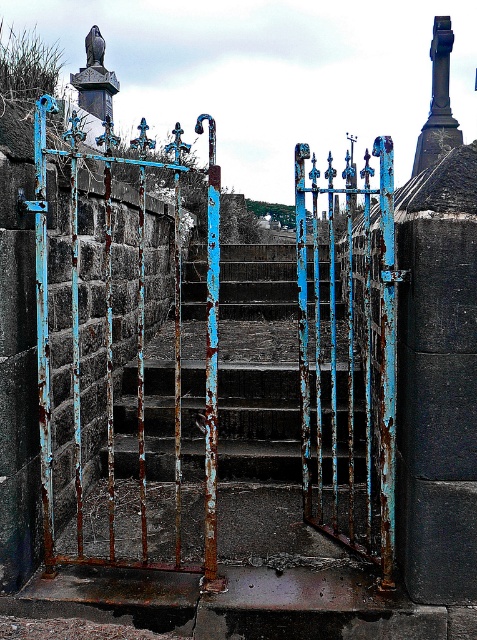
You are a delivery person with a large box that is 1.5 meters wide. You need to pass through the entrance shown in the image. Can your box fit through the rusty metal gate at center without touching the rusty metal stairs at center?

The rusty metal gate at center is narrower than the rusty metal stairs at center. Since your box is 1.5 meters wide and the gate is narrower, the box may not fit through without touching the stairs or the gate itself. It is advisable to find an alternative route or a smaller entrance.

You are standing in front of the weathered metal gate and want to take a photo of both point (382, 406) and point (362, 410). Which point should you focus on first to ensure both are in focus?

Point (382, 406) is closer to the camera than point (362, 410), so you should focus on point (382, 406) first to ensure both are in focus.